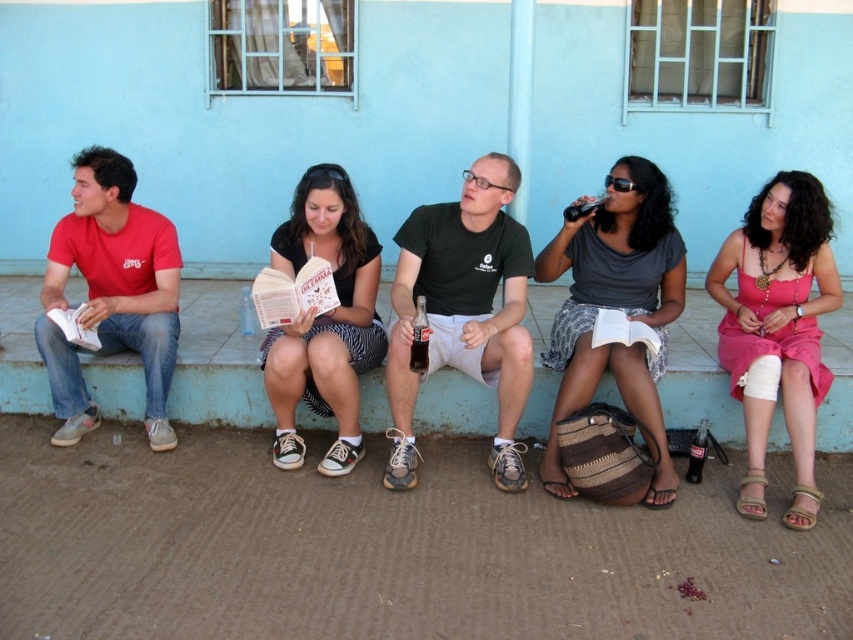
Question: Which point is closer to the camera?

Choices:
 (A) pink satin dress at lower right
 (B) green matte shirt at center

Answer: (A)

Question: Can you confirm if matte gray blouse at center is positioned above matte black book at center?

Choices:
 (A) no
 (B) yes

Answer: (A)

Question: Among these points, which one is farthest from the camera?

Choices:
 (A) (291, 465)
 (B) (503, 186)
 (C) (427, 339)
 (D) (827, 230)

Answer: (D)

Question: Which object appears closest to the camera in this image?

Choices:
 (A) matte black book at center
 (B) matte gray blouse at center
 (C) blue painted concrete ledge at lower center

Answer: (B)

Question: Can you confirm if green matte shirt at center is positioned to the right of light brown woven sandal at lower right?

Choices:
 (A) yes
 (B) no

Answer: (B)

Question: Can you confirm if green matte shirt at center is thinner than beige fabric sandal at lower right?

Choices:
 (A) yes
 (B) no

Answer: (B)